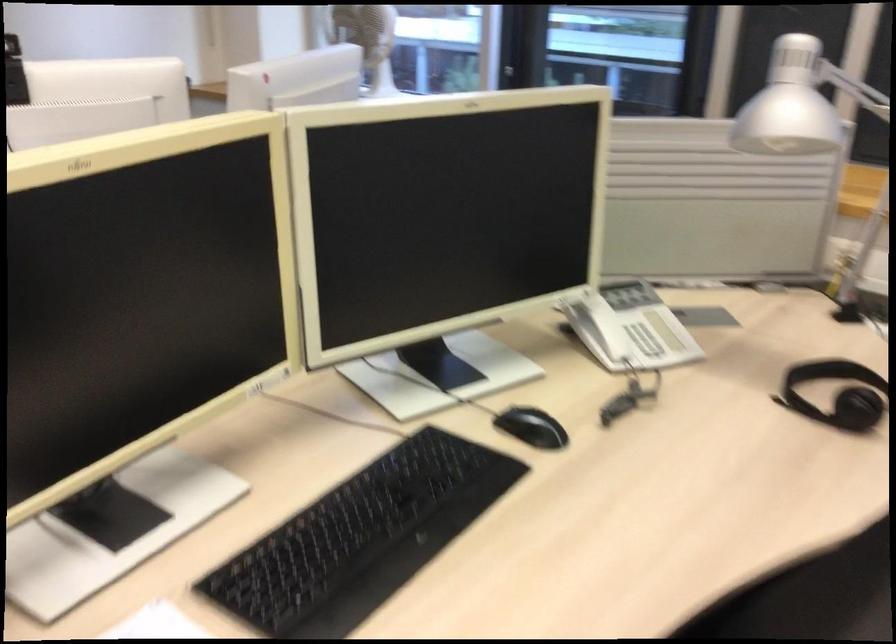
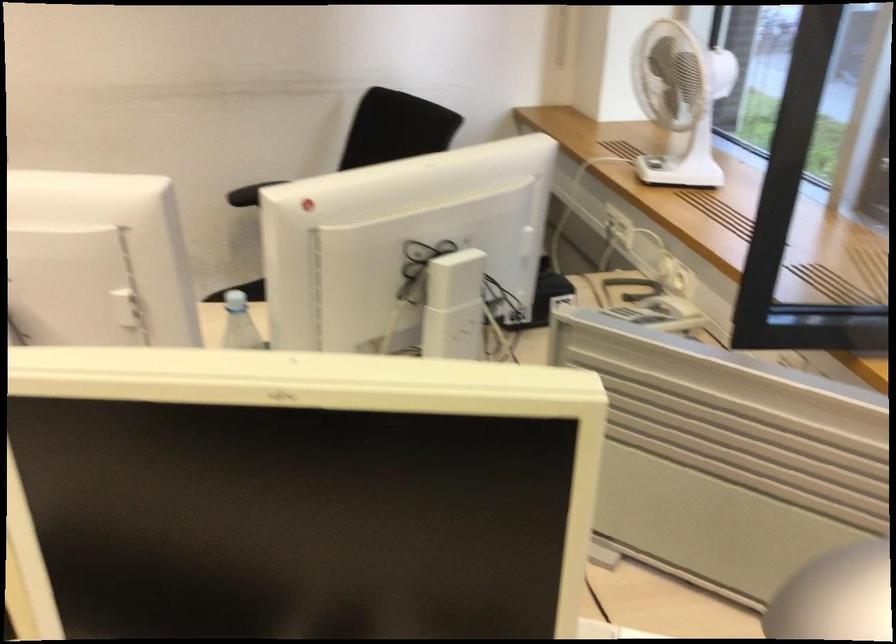
Question: The first image is from the beginning of the video and the second image is from the end. How did the camera likely rotate when shooting the video?

Choices:
 (A) Left
 (B) Right
 (C) Up
 (D) Down

Answer: (A)